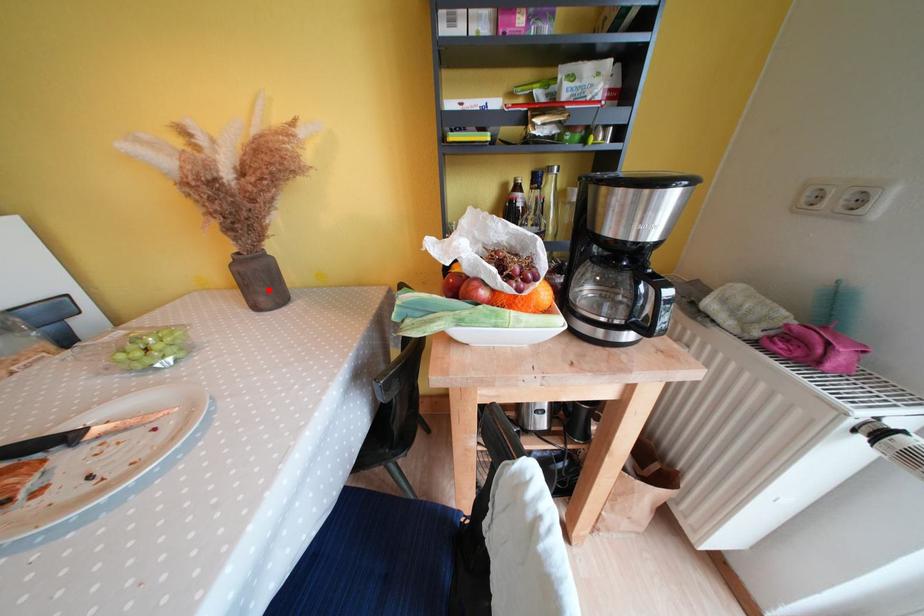
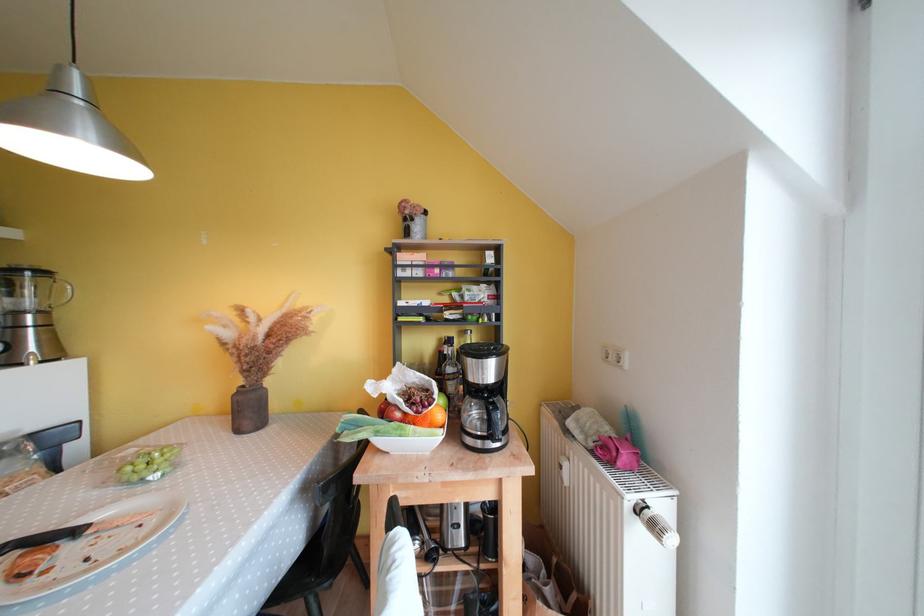
In the second image, find the point that corresponds to the highlighted location in the first image.

(256, 416)